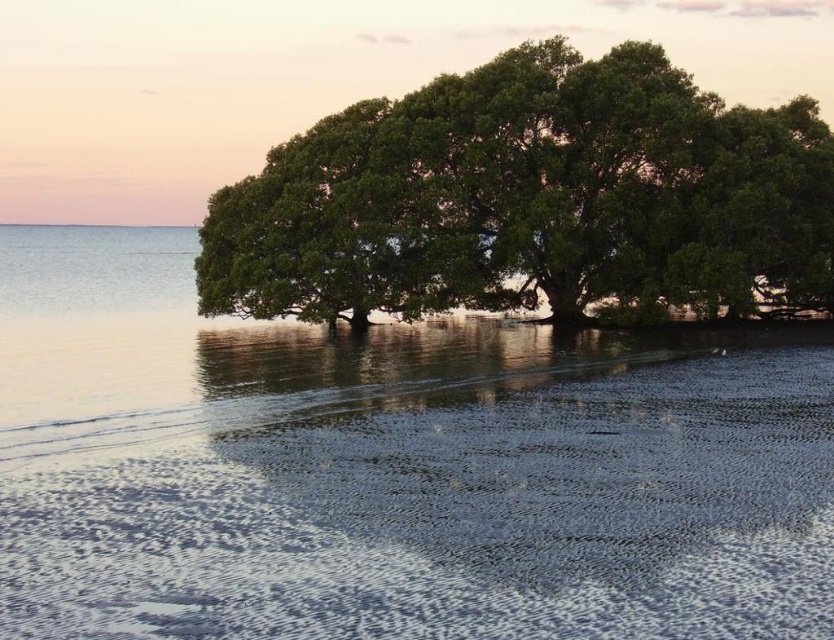
Is smooth sand at lower center taller than green leafy tree at center?

In fact, smooth sand at lower center may be shorter than green leafy tree at center.

Is smooth sand at lower center below green leafy tree at center?

Yes, smooth sand at lower center is below green leafy tree at center.

Is point (426, 625) positioned after point (255, 257)?

No, (426, 625) is closer to viewer.

At what (x,y) coordinates should I click in order to perform the action: click on smooth sand at lower center. Please return your answer as a coordinate pair (x, y). Image resolution: width=834 pixels, height=640 pixels. Looking at the image, I should click on click(455, 518).